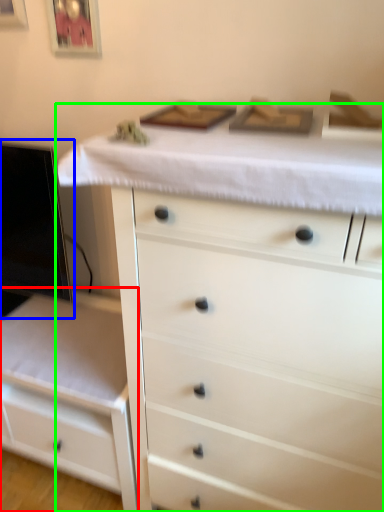
Question: Estimate the real-world distances between objects in this image. Which object is farther from chest of drawers (highlighted by a red box), computer monitor (highlighted by a blue box) or chest of drawers (highlighted by a green box)?

Choices:
 (A) computer monitor
 (B) chest of drawers

Answer: (B)